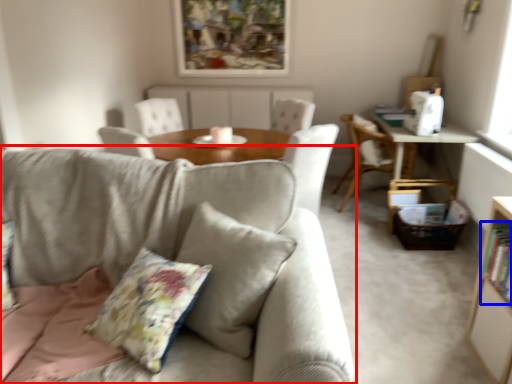
Question: Which object appears closest to the camera in this image, studio couch (highlighted by a red box) or book (highlighted by a blue box)?

Choices:
 (A) studio couch
 (B) book

Answer: (A)